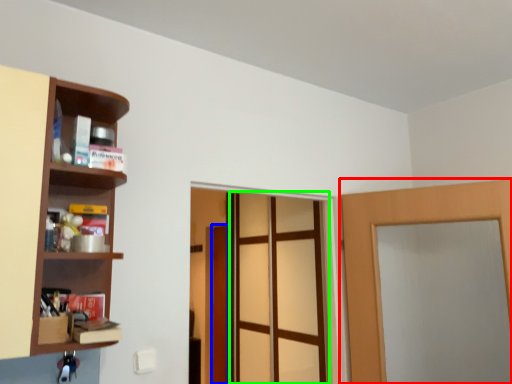
Question: Which object is positioned closest to door (highlighted by a red box)? Select from door (highlighted by a blue box) and screen door (highlighted by a green box).

Choices:
 (A) door
 (B) screen door

Answer: (B)